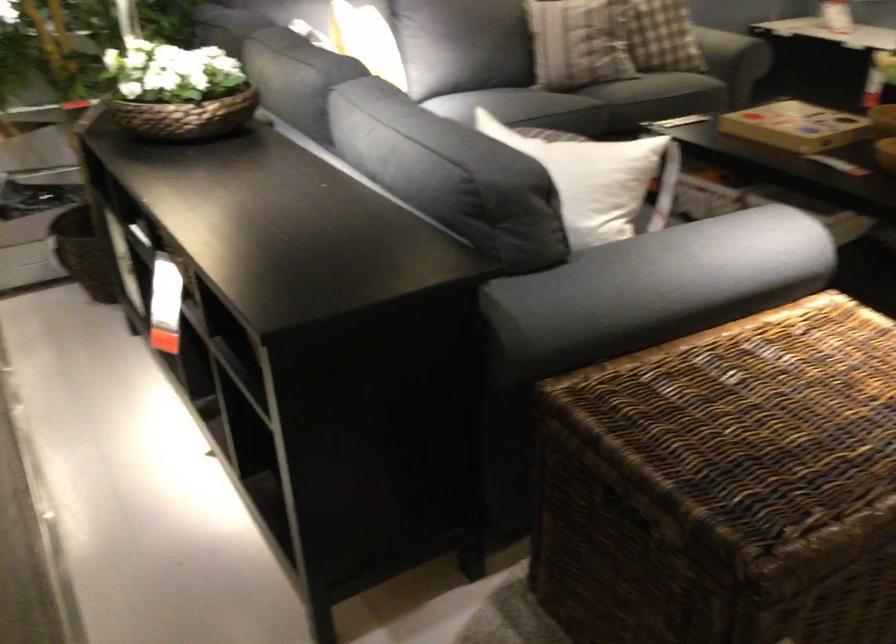
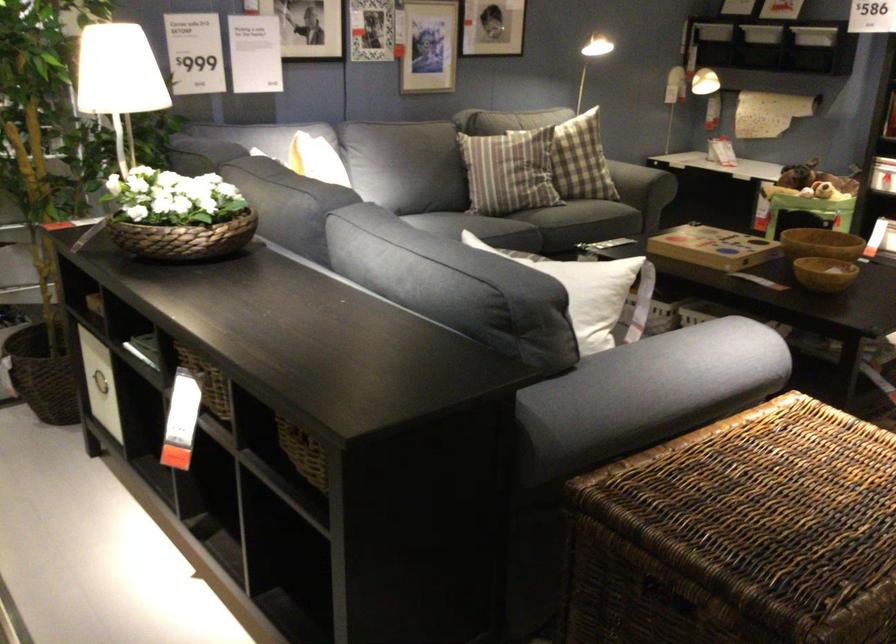
The point at (648, 290) is marked in the first image. Where is the corresponding point in the second image?

(647, 393)